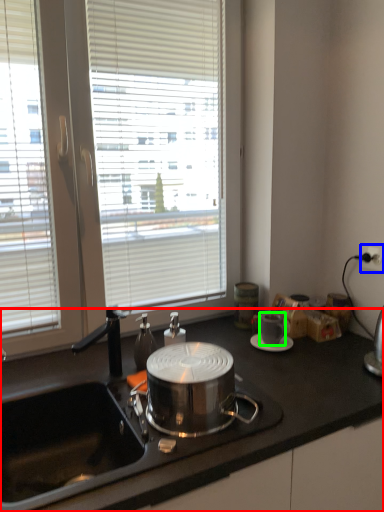
Question: Which is nearer to the countertop (highlighted by a red box)? power outlet (highlighted by a blue box) or coffee cup (highlighted by a green box).

Choices:
 (A) power outlet
 (B) coffee cup

Answer: (B)